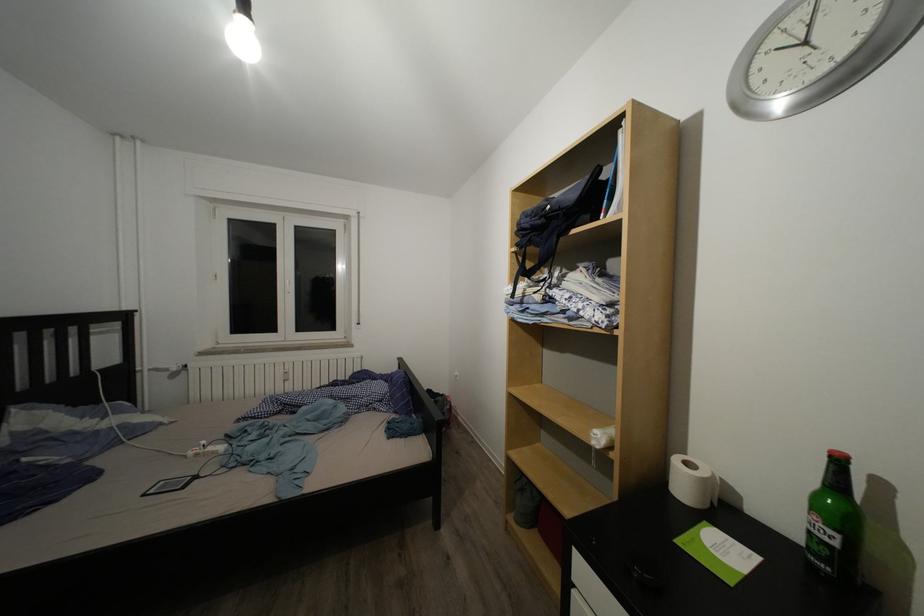
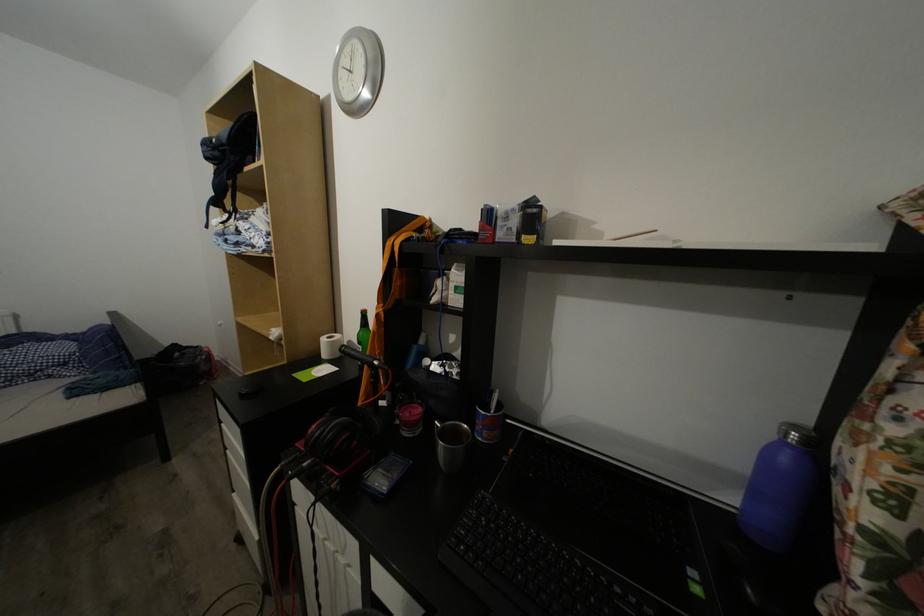
Question: How did the camera likely rotate?

Choices:
 (A) Left
 (B) Right
 (C) Up
 (D) Down

Answer: (B)